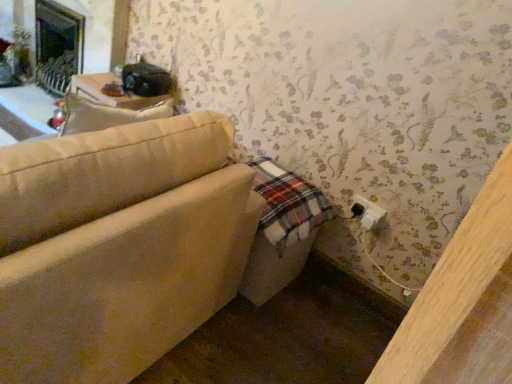
The width and height of the screenshot is (512, 384). Identify the location of beige fabric couch at lower left. (118, 246).

This screenshot has width=512, height=384. Describe the element at coordinates (118, 246) in the screenshot. I see `beige fabric couch at lower left` at that location.

At what (x,y) coordinates should I click in order to perform the action: click on white plastic electric outlet at lower right. Please return your answer as a coordinate pair (x, y). The width and height of the screenshot is (512, 384). Looking at the image, I should click on (367, 213).

Describe the element at coordinates (367, 213) in the screenshot. I see `white plastic electric outlet at lower right` at that location.

Find the location of a particular element. The height and width of the screenshot is (384, 512). beige fabric couch at lower left is located at coordinates (118, 246).

Can you confirm if beige fabric couch at lower left is positioned to the left of white plastic electric outlet at lower right?

Yes.

Is beige fabric couch at lower left positioned behind white plastic electric outlet at lower right?

No, beige fabric couch at lower left is closer to the camera.

Between point (93, 362) and point (380, 208), which one is positioned behind?

The point (380, 208) is farther.

From the image's perspective, which is above, beige fabric couch at lower left or white plastic electric outlet at lower right?

beige fabric couch at lower left, from the image's perspective.

From a real-world perspective, does beige fabric couch at lower left stand above white plastic electric outlet at lower right?

No.

Considering the sizes of beige fabric couch at lower left and white plastic electric outlet at lower right in the image, is beige fabric couch at lower left wider or thinner than white plastic electric outlet at lower right?

Considering their sizes, beige fabric couch at lower left looks broader than white plastic electric outlet at lower right.

Is beige fabric couch at lower left taller than white plastic electric outlet at lower right?

Correct, beige fabric couch at lower left is much taller as white plastic electric outlet at lower right.

From the picture: Who is smaller, beige fabric couch at lower left or white plastic electric outlet at lower right?

white plastic electric outlet at lower right.

Is beige fabric couch at lower left inside the boundaries of white plastic electric outlet at lower right, or outside?

beige fabric couch at lower left lies outside white plastic electric outlet at lower right.

Would you consider beige fabric couch at lower left to be distant from white plastic electric outlet at lower right?

Indeed, beige fabric couch at lower left is not near white plastic electric outlet at lower right.

Is beige fabric couch at lower left aimed at white plastic electric outlet at lower right?

No, beige fabric couch at lower left is not oriented towards white plastic electric outlet at lower right.

The height and width of the screenshot is (384, 512). I want to click on electric outlet located behind the beige fabric couch at lower left, so click(x=367, y=213).

Would you say white plastic electric outlet at lower right is to the left or to the right of beige fabric couch at lower left in the picture?

From the image, it's evident that white plastic electric outlet at lower right is to the right of beige fabric couch at lower left.

Does white plastic electric outlet at lower right come behind beige fabric couch at lower left?

Yes.

Considering the positions of point (356, 204) and point (25, 187), is point (356, 204) closer or farther from the camera than point (25, 187)?

Clearly, point (356, 204) is more distant from the camera than point (25, 187).

From the image's perspective, is white plastic electric outlet at lower right located above beige fabric couch at lower left?

Incorrect, from the image's perspective, white plastic electric outlet at lower right is lower than beige fabric couch at lower left.

From a real-world perspective, who is located higher, white plastic electric outlet at lower right or beige fabric couch at lower left?

white plastic electric outlet at lower right.

Looking at their sizes, would you say white plastic electric outlet at lower right is wider or thinner than beige fabric couch at lower left?

Clearly, white plastic electric outlet at lower right has less width compared to beige fabric couch at lower left.

Can you confirm if white plastic electric outlet at lower right is shorter than beige fabric couch at lower left?

Yes.

In the scene shown: Does white plastic electric outlet at lower right have a larger size compared to beige fabric couch at lower left?

No.

Is white plastic electric outlet at lower right not within beige fabric couch at lower left?

white plastic electric outlet at lower right lies outside beige fabric couch at lower left's area.

Is white plastic electric outlet at lower right next to beige fabric couch at lower left?

They are not placed beside each other.

Is beige fabric couch at lower left at the back of white plastic electric outlet at lower right?

No, white plastic electric outlet at lower right is not facing away from beige fabric couch at lower left.

Can you tell me how much white plastic electric outlet at lower right and beige fabric couch at lower left differ in facing direction?

87.6 degrees separate the facing orientations of white plastic electric outlet at lower right and beige fabric couch at lower left.

Measure the distance from white plastic electric outlet at lower right to beige fabric couch at lower left.

white plastic electric outlet at lower right and beige fabric couch at lower left are 3.39 feet apart.

At what (x,y) coordinates should I click in order to perform the action: click on electric outlet that appears on the right of beige fabric couch at lower left. Please return your answer as a coordinate pair (x, y). This screenshot has height=384, width=512. Looking at the image, I should click on (367, 213).

At what (x,y) coordinates should I click in order to perform the action: click on studio couch below the white plastic electric outlet at lower right (from a real-world perspective). Please return your answer as a coordinate pair (x, y). Looking at the image, I should click on [118, 246].

The width and height of the screenshot is (512, 384). Find the location of `electric outlet that is on the right side of beige fabric couch at lower left`. electric outlet that is on the right side of beige fabric couch at lower left is located at coordinates (367, 213).